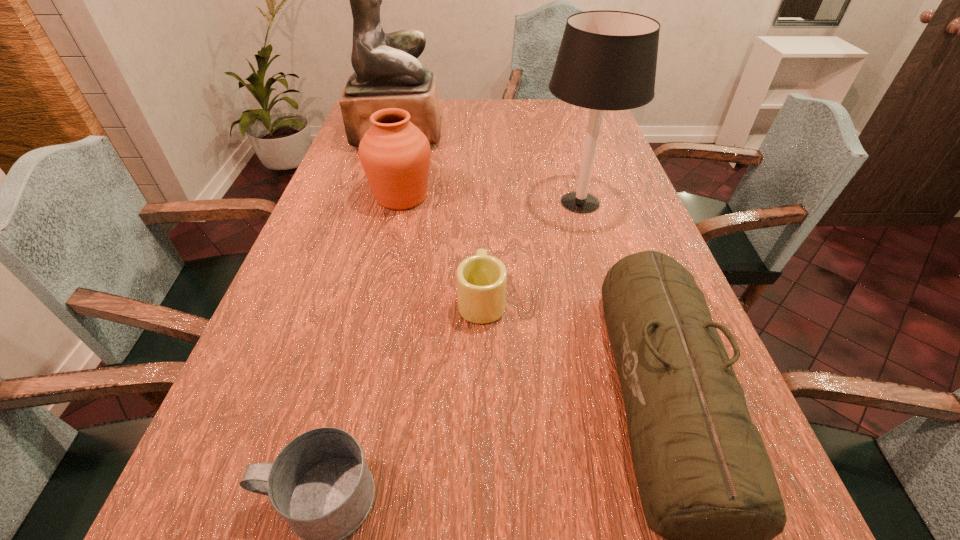
Locate an element on the screen. blank space at the far right corner is located at coordinates (581, 116).

The height and width of the screenshot is (540, 960). Identify the location of object that stands as the closest to the third object from right to left. (706, 483).

You are a GUI agent. You are given a task and a screenshot of the screen. Output one action in this format:
    pyautogui.click(x=<x>, y=<y>)
    Task: Click on the object that is the closest one to the tallest object
    
    Given the screenshot: What is the action you would take?
    pyautogui.click(x=395, y=155)

In order to click on vacant space that satisfies the following two spatial constraints: 1. in a relaxed pose on the tallest object; 2. on the left side of the second tallest object in this screenshot , I will do `click(378, 202)`.

The image size is (960, 540). Identify the location of free spot that satisfies the following two spatial constraints: 1. in a relaxed pose on the tallest object; 2. on the left side of the third tallest object. (380, 197).

At what (x,y) coordinates should I click in order to perform the action: click on free location that satisfies the following two spatial constraints: 1. on the front side of the fifth shortest object; 2. on the left side of the fourth shortest object. Please return your answer as a coordinate pair (x, y). This screenshot has width=960, height=540. Looking at the image, I should click on tap(400, 202).

Identify the location of vacant space that satisfies the following two spatial constraints: 1. in a relaxed pose on the tallest object; 2. on the back side of the second tallest object. The height and width of the screenshot is (540, 960). (378, 202).